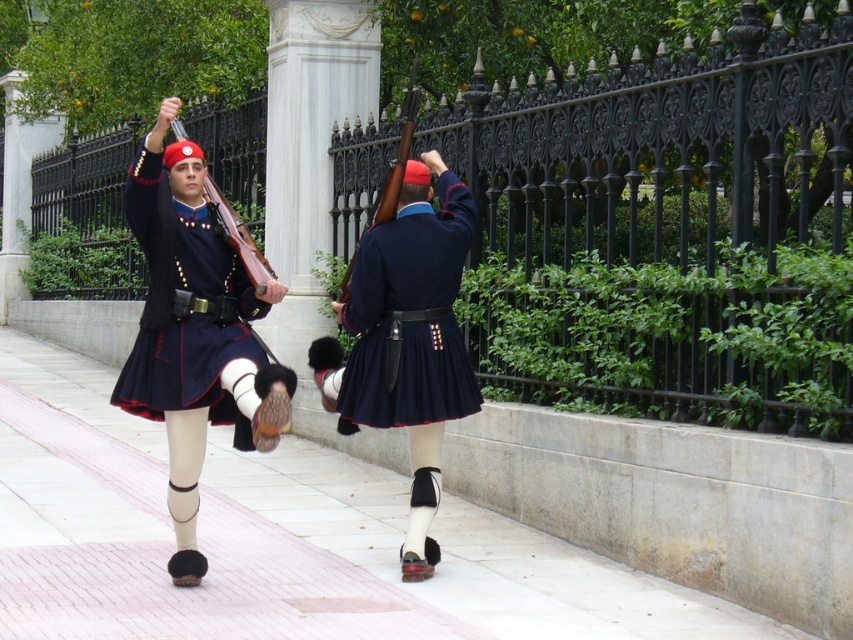
You are a photographer planning to capture a closeup shot of the matte black kilt at center while ensuring the pink brick pavement at lower center is still visible in the frame. Given their size difference, will you need to adjust your camera angle to include both?

The pink brick pavement at lower center is larger in size than matte black kilt at center, so you will need to adjust your camera angle to ensure both are visible in the frame.

You are a photographer trying to capture a closeup of the guards while standing on the pink brick pavement at lower center. Since the matte blue kilt at center is part of the guards uniform, which direction should you move to get a better shot without moving the guards?

The pink brick pavement at lower center is positioned on the left side of the matte blue kilt at center, so you should move to the right to get a better shot of the guards.